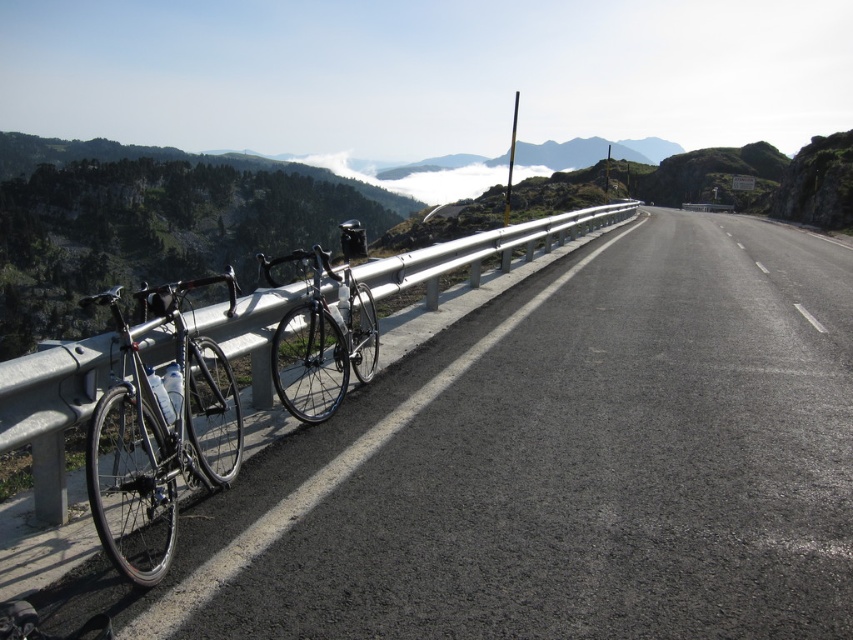
Question: Which of these objects is positioned farthest from the silver metallic rail at left?

Choices:
 (A) shiny black bicycle at center
 (B) shiny silver bicycle at left

Answer: (B)

Question: Which of the following is the closest to the observer?

Choices:
 (A) (335, 272)
 (B) (154, 381)
 (C) (3, 394)

Answer: (C)

Question: Where is shiny silver bicycle at left located in relation to shiny black bicycle at center in the image?

Choices:
 (A) below
 (B) above

Answer: (A)

Question: Is shiny silver bicycle at left to the right of shiny black bicycle at center from the viewer's perspective?

Choices:
 (A) no
 (B) yes

Answer: (A)

Question: Is the position of silver metallic rail at left more distant than that of shiny black bicycle at center?

Choices:
 (A) yes
 (B) no

Answer: (B)

Question: Among these objects, which one is farthest from the camera?

Choices:
 (A) silver metallic rail at left
 (B) shiny silver bicycle at left

Answer: (B)